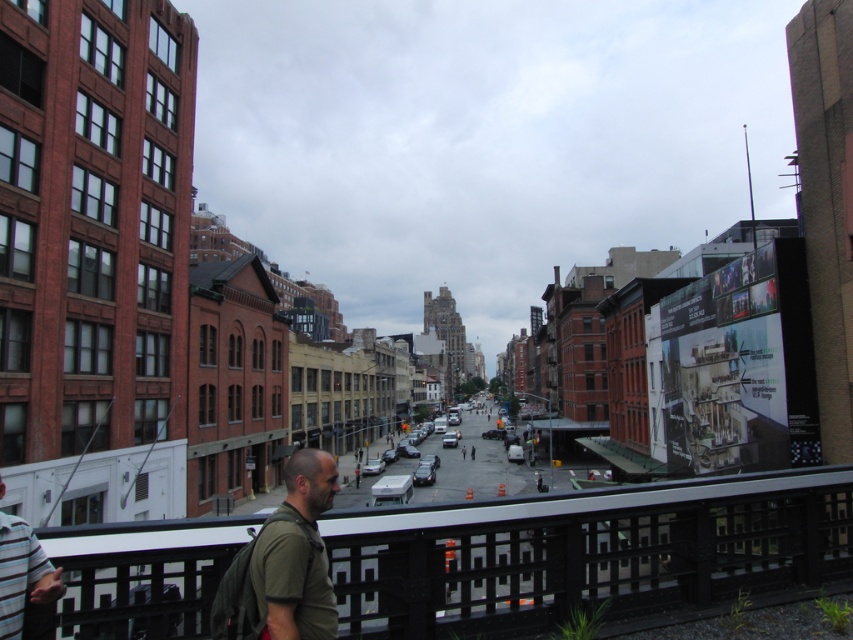
Is black metal rail at lower center taller than striped cotton shirt at lower left?

Correct, black metal rail at lower center is much taller as striped cotton shirt at lower left.

Who is lower down, black metal rail at lower center or striped cotton shirt at lower left?

black metal rail at lower center

Where is `black metal rail at lower center`? This screenshot has width=853, height=640. black metal rail at lower center is located at coordinates (584, 552).

Who is lower down, green matte shirt at lower center or striped cotton shirt at lower left?

green matte shirt at lower center

Who is positioned more to the right, green matte shirt at lower center or striped cotton shirt at lower left?

Positioned to the right is green matte shirt at lower center.

Is point (282, 600) farther from camera compared to point (32, 545)?

No, (282, 600) is closer to viewer.

The image size is (853, 640). Find the location of `green matte shirt at lower center`. green matte shirt at lower center is located at coordinates (297, 554).

Between black metal rail at lower center and green matte shirt at lower center, which one appears on the right side from the viewer's perspective?

black metal rail at lower center

Which of these two, black metal rail at lower center or green matte shirt at lower center, stands shorter?

With less height is black metal rail at lower center.

Find the location of a particular element. The image size is (853, 640). black metal rail at lower center is located at coordinates (584, 552).